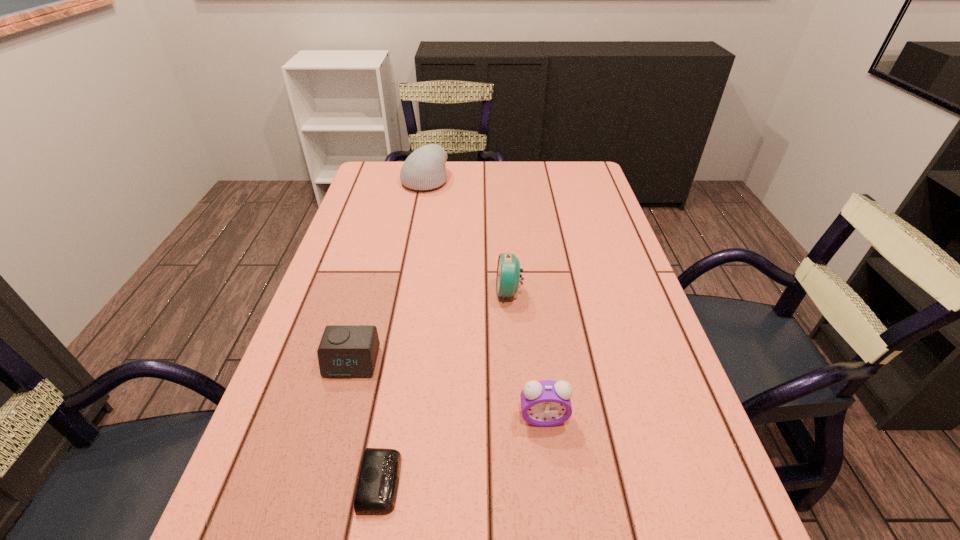
Find the location of a particular element. blank space at the right edge of the desktop is located at coordinates (587, 207).

This screenshot has height=540, width=960. In the image, there is a desktop. What are the coordinates of `free space at the far left corner` in the screenshot? It's located at tap(374, 186).

Find the location of a particular element. The width and height of the screenshot is (960, 540). vacant region at the far right corner of the desktop is located at coordinates (581, 191).

This screenshot has width=960, height=540. In order to click on vacant space in between the second farthest alarm clock and the farthest alarm clock in this screenshot , I will do `click(430, 327)`.

I want to click on empty space between the third nearest object and the beanie, so click(388, 271).

Locate an element on the screen. vacant space in between the leftmost alarm clock and the fourth farthest object is located at coordinates (447, 390).

The height and width of the screenshot is (540, 960). Identify the location of unoccupied area between the leftmost alarm clock and the nearest alarm clock. (366, 422).

I want to click on vacant region between the second farthest alarm clock and the farthest alarm clock, so (430, 327).

Where is `vacant space that is in between the fourth tallest object and the fourth farthest object`? This screenshot has width=960, height=540. vacant space that is in between the fourth tallest object and the fourth farthest object is located at coordinates (447, 390).

At what (x,y) coordinates should I click in order to perform the action: click on vacant area between the second shortest alarm clock and the second nearest object. Please return your answer as a coordinate pair (x, y). Looking at the image, I should click on (447, 390).